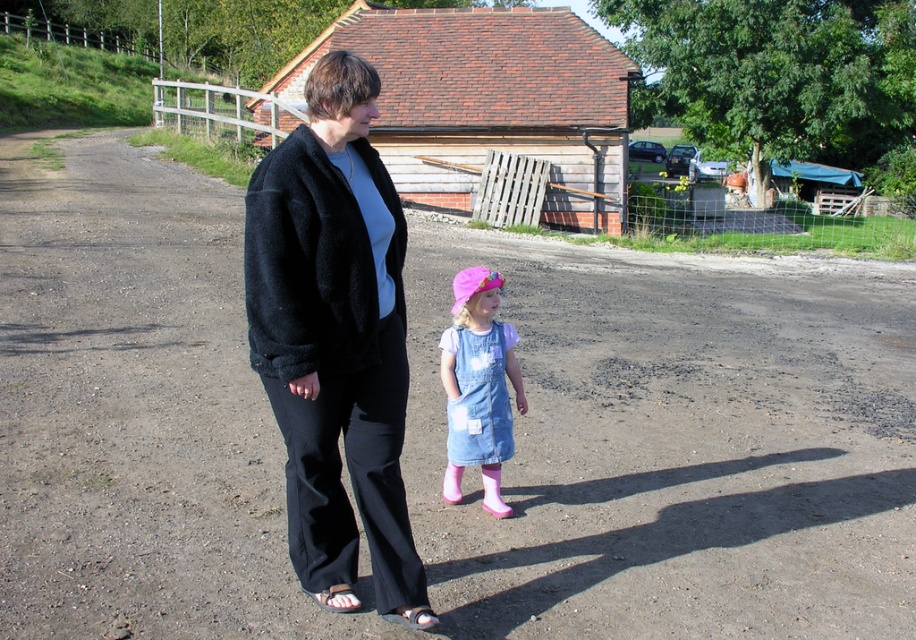
In the scene shown: You are a photographer trying to capture a photo of the black fuzzy jacket at center and the denim overall at lower right. To ensure both are in focus, you need to know their vertical positions. Which object is higher in the image?

The black fuzzy jacket at center is located above the denim overall at lower right, so it is higher in the image.

You are a photographer trying to capture a photo of the black fuzzy jacket at center and the black leather sandal at lower center. Since you want both items to be clearly visible in the frame, which one should you focus on first to ensure proper depth of field?

The black fuzzy jacket at center is located above the black leather sandal at lower center, so you should focus on the black fuzzy jacket at center first because it is closer to the camera, ensuring both items are in focus.